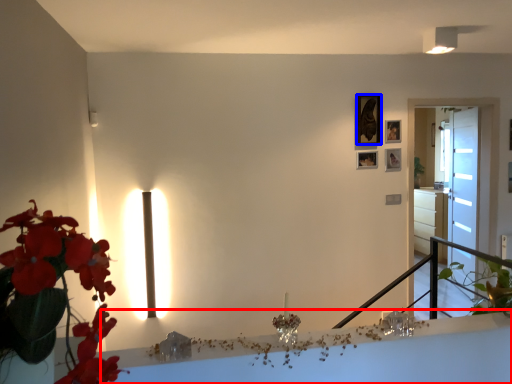
Question: Which object appears closest to the camera in this image, table (highlighted by a red box) or picture frame (highlighted by a blue box)?

Choices:
 (A) table
 (B) picture frame

Answer: (A)